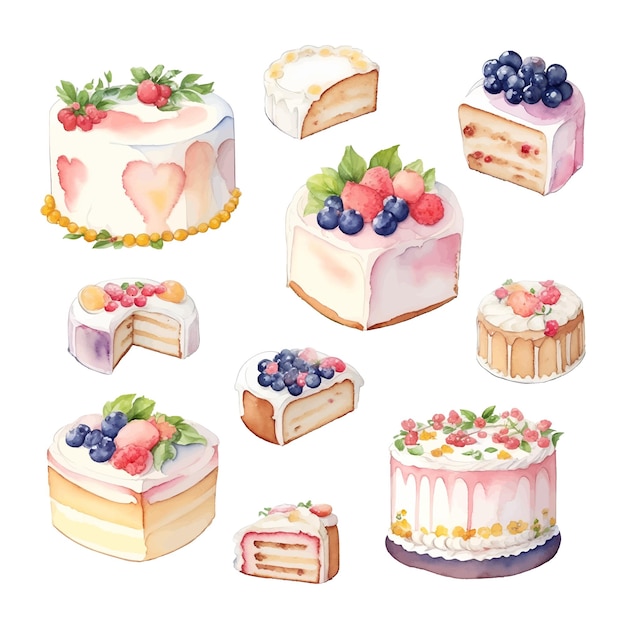
Identify the location of un-whole cakes. Image resolution: width=626 pixels, height=626 pixels. (283, 546), (290, 386), (498, 138), (317, 81), (160, 293).